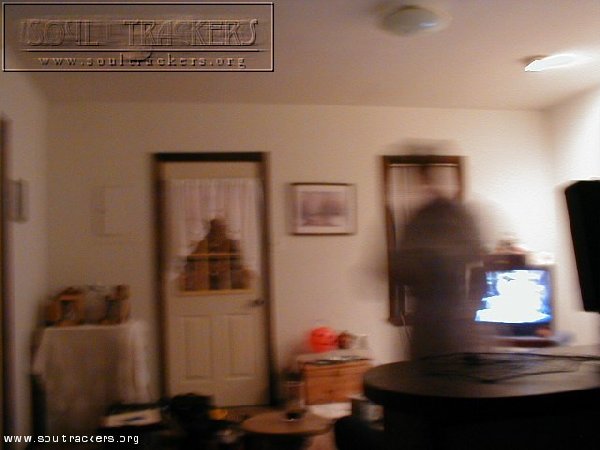
You are a GUI agent. You are given a task and a screenshot of the screen. Output one action in this format:
    pyautogui.click(x=<x>, y=<y>)
    Task: Click on the light
    
    Given the screenshot: What is the action you would take?
    pyautogui.click(x=553, y=60)